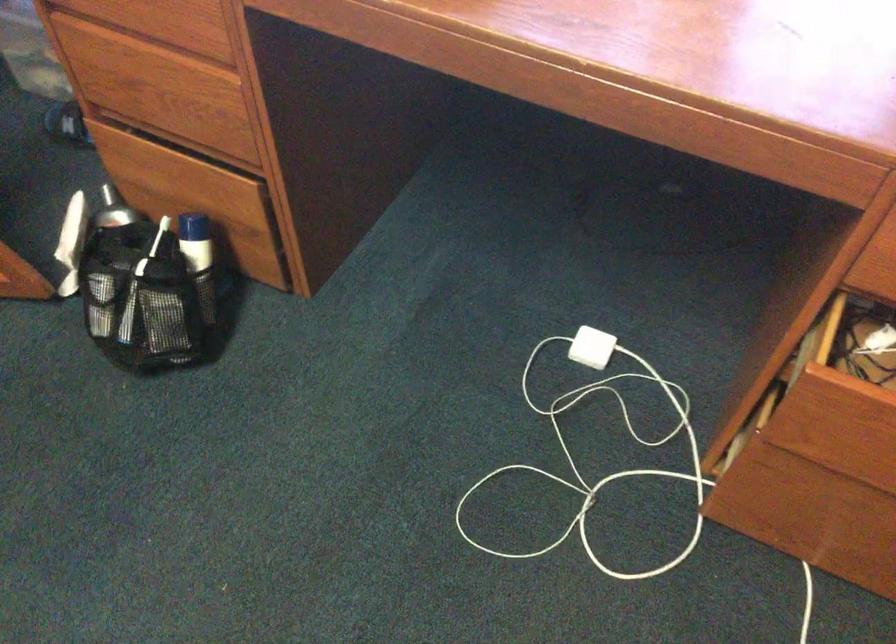
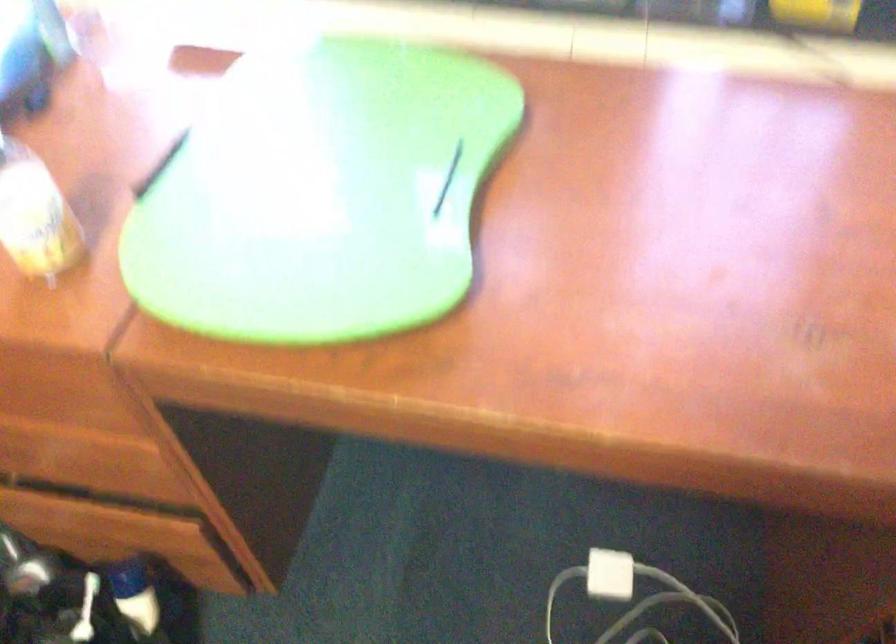
Question: The camera is either moving clockwise (left) or counter-clockwise (right) around the object. The first image is from the beginning of the video and the second image is from the end. Is the camera moving left or right when shooting the video?

Choices:
 (A) Left
 (B) Right

Answer: (A)